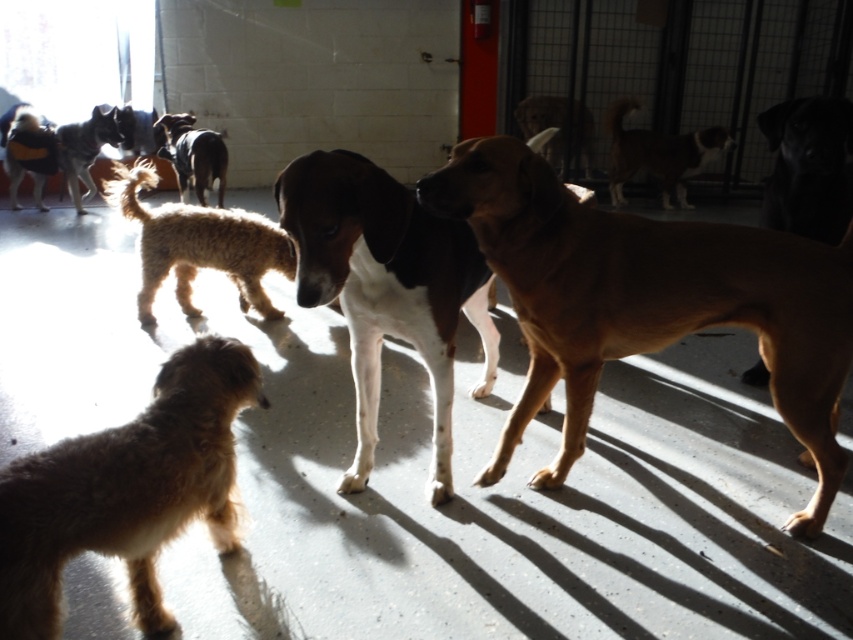
You are a dog trainer trying to separate two dogs. You have a leash that can reach 30 inches. The dogs are the brown smooth dog at center and the fuzzy brown dog at lower left. Can you reach both dogs with the leash without moving?

The brown smooth dog at center is 34.03 inches away from the fuzzy brown dog at lower left. Since the leash can only reach 30 inches, you cannot reach both dogs with the leash without moving.